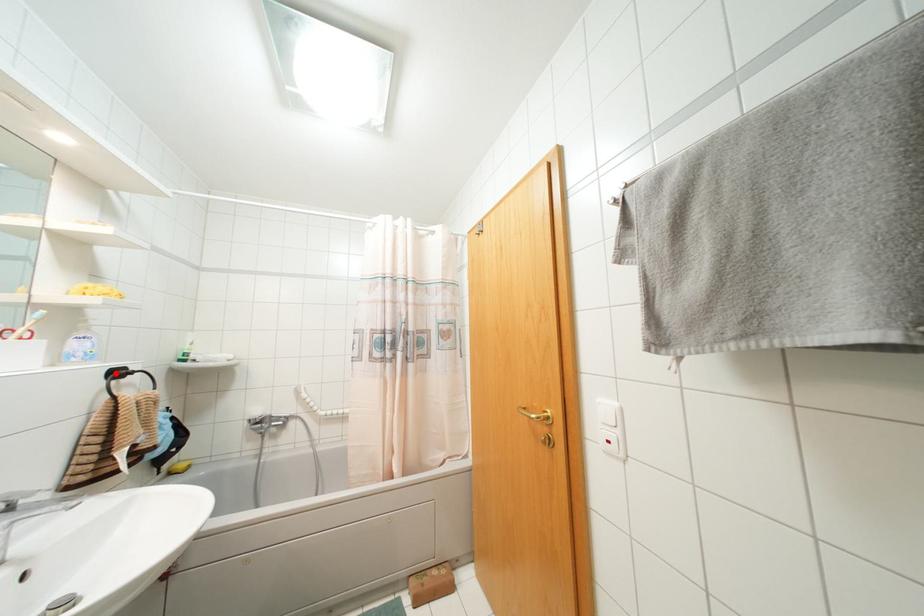
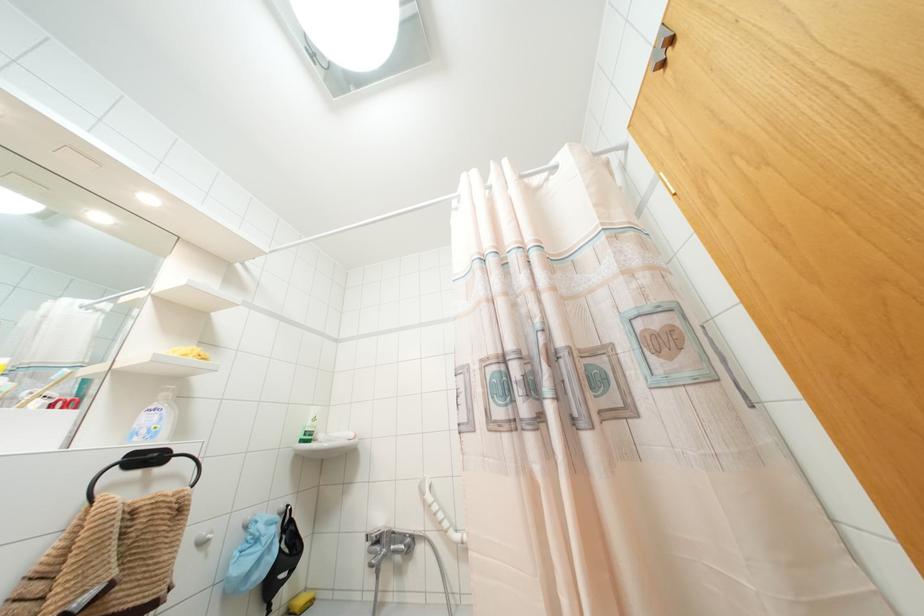
Find the pixel in the second image that matches the highlighted location in the first image.

(147, 458)